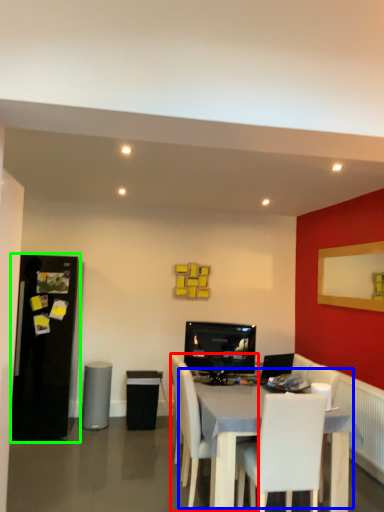
Question: Estimate the real-world distances between objects in this image. Which object is closer to chair (highlighted by a red box), table (highlighted by a blue box) or fridge (highlighted by a green box)?

Choices:
 (A) table
 (B) fridge

Answer: (A)